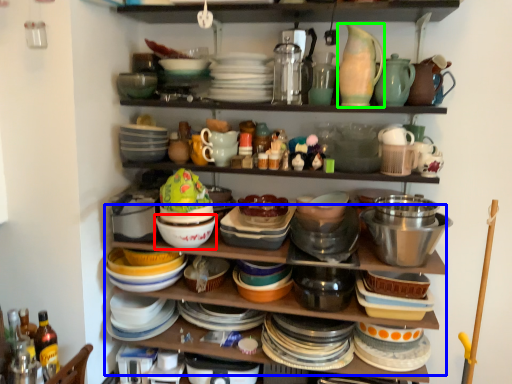
Question: Which is nearer to the bowl (highlighted by a red box)? shelf (highlighted by a blue box) or tableware (highlighted by a green box).

Choices:
 (A) shelf
 (B) tableware

Answer: (A)